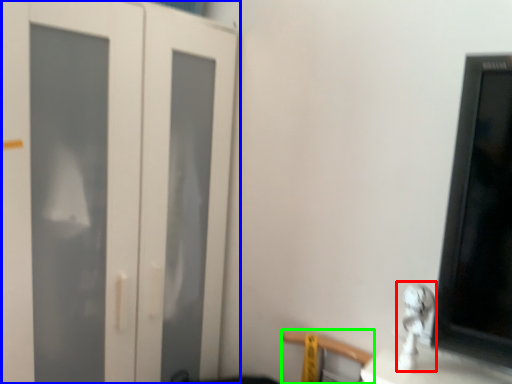
Question: Which object is positioned closest to silver (highlighted by a red box)? Select from door (highlighted by a blue box) and chair (highlighted by a green box).

Choices:
 (A) door
 (B) chair

Answer: (B)